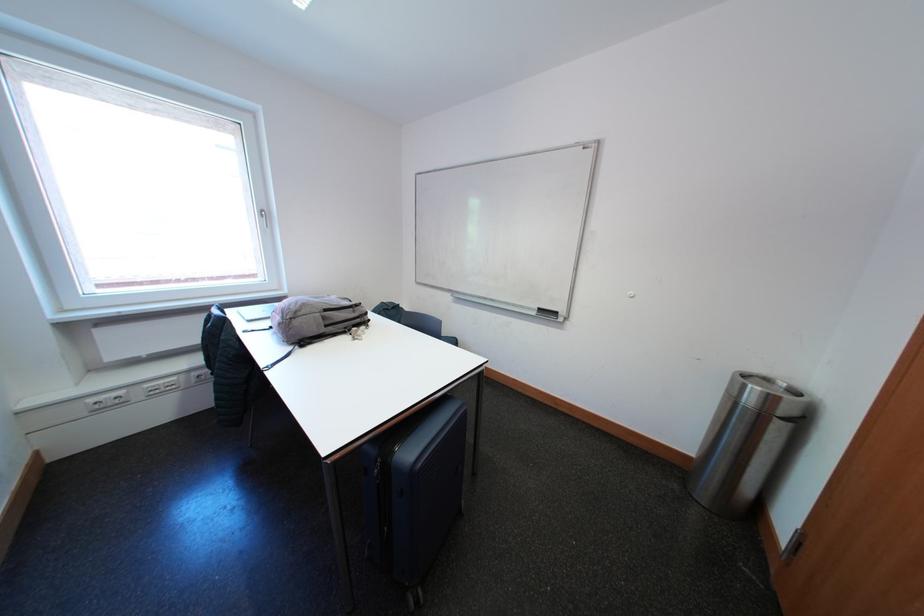
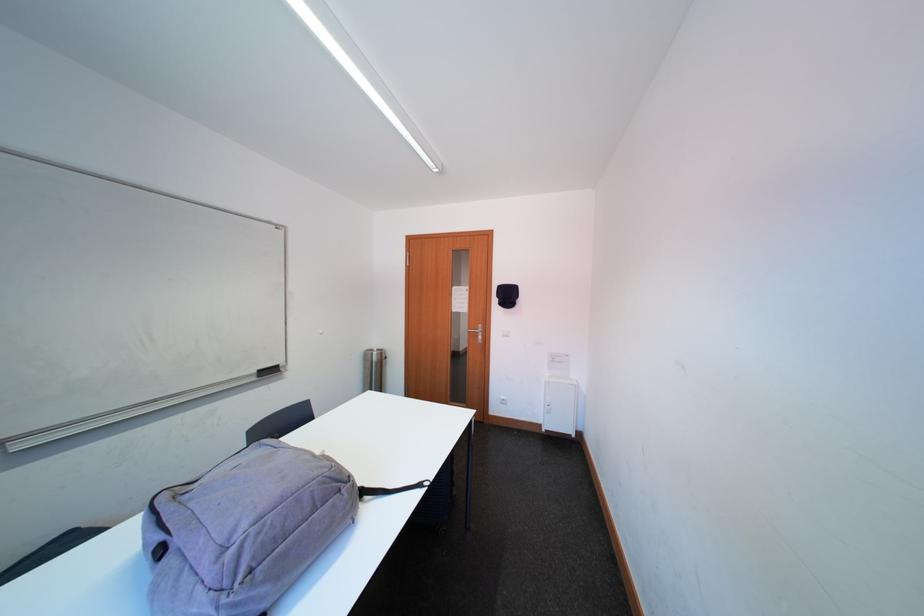
The point at (754, 389) is marked in the first image. Where is the corresponding point in the second image?

(382, 358)